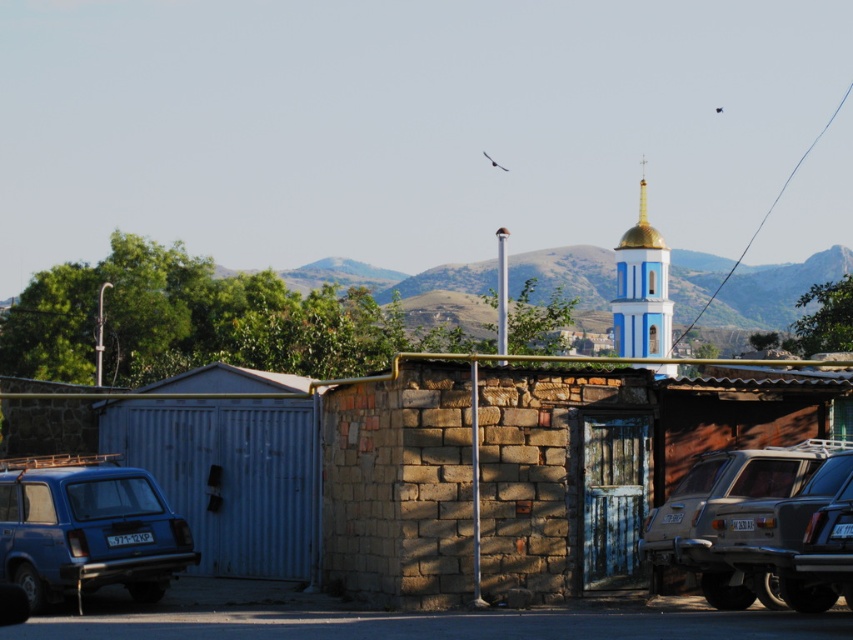
Question: Which point appears closest to the camera in this image?

Choices:
 (A) (15, 480)
 (B) (709, 477)
 (C) (639, 237)
 (D) (265, 440)

Answer: (B)

Question: Which object appears farthest from the camera in this image?

Choices:
 (A) brown brick hut at center
 (B) matte silver suv at lower right

Answer: (A)

Question: Among these objects, which one is farthest from the camera?

Choices:
 (A) blue painted stone tower at upper right
 (B) brown brick hut at center
 (C) matte blue suv at lower left

Answer: (A)

Question: Observing the image, what is the correct spatial positioning of matte blue suv at lower left in reference to matte silver suv at lower right?

Choices:
 (A) above
 (B) below

Answer: (B)

Question: Can you confirm if metallic blue shed at left is positioned to the right of matte blue suv at lower left?

Choices:
 (A) no
 (B) yes

Answer: (B)

Question: Is matte silver suv at lower right thinner than blue painted stone tower at upper right?

Choices:
 (A) no
 (B) yes

Answer: (B)